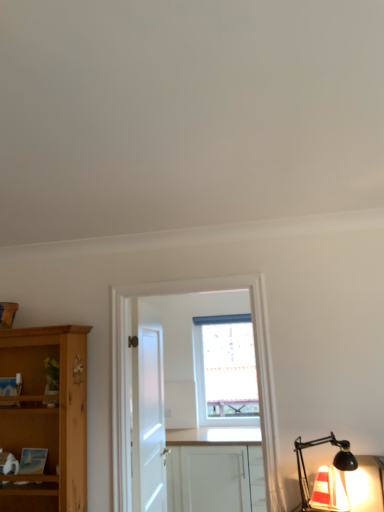
Question: Is white matte door at center outside white wooden cabinet at center?

Choices:
 (A) yes
 (B) no

Answer: (A)

Question: Can you confirm if white matte door at center is thinner than white wooden cabinet at center?

Choices:
 (A) yes
 (B) no

Answer: (B)

Question: From the image's perspective, is white matte door at center located beneath white wooden cabinet at center?

Choices:
 (A) yes
 (B) no

Answer: (A)

Question: Is the surface of white matte door at center in direct contact with white wooden cabinet at center?

Choices:
 (A) yes
 (B) no

Answer: (B)

Question: From the image's perspective, does white matte door at center appear higher than white wooden cabinet at center?

Choices:
 (A) no
 (B) yes

Answer: (A)

Question: Is white matte door at center at the right side of white wooden cabinet at center?

Choices:
 (A) no
 (B) yes

Answer: (A)

Question: Does white wooden cabinet at center appear on the left side of transparent glass window at center?

Choices:
 (A) no
 (B) yes

Answer: (B)

Question: Does white wooden cabinet at center touch transparent glass window at center?

Choices:
 (A) no
 (B) yes

Answer: (A)

Question: Is white wooden cabinet at center shorter than transparent glass window at center?

Choices:
 (A) yes
 (B) no

Answer: (B)

Question: Is white wooden cabinet at center positioned behind transparent glass window at center?

Choices:
 (A) no
 (B) yes

Answer: (A)

Question: Is white wooden cabinet at center not within transparent glass window at center?

Choices:
 (A) no
 (B) yes

Answer: (B)

Question: Does white wooden cabinet at center come in front of transparent glass window at center?

Choices:
 (A) no
 (B) yes

Answer: (B)

Question: Is translucent glass lamp at lower right positioned far away from white matte cabinet at center?

Choices:
 (A) no
 (B) yes

Answer: (B)